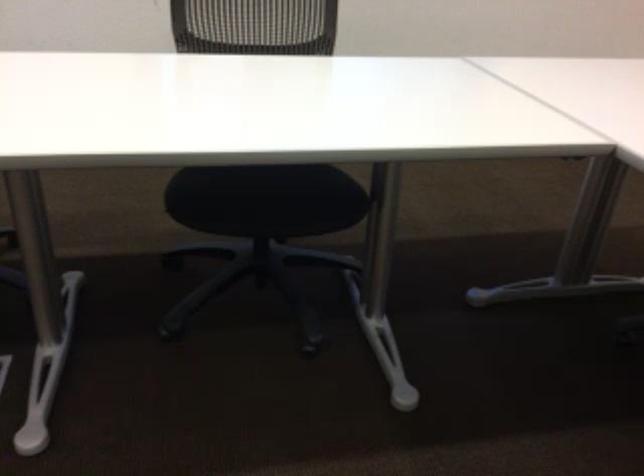
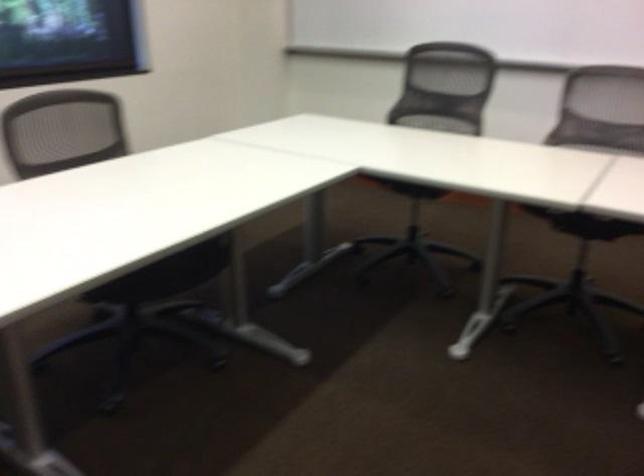
Find the pixel in the second image that matches pixel 256 210 in the first image.

(166, 275)